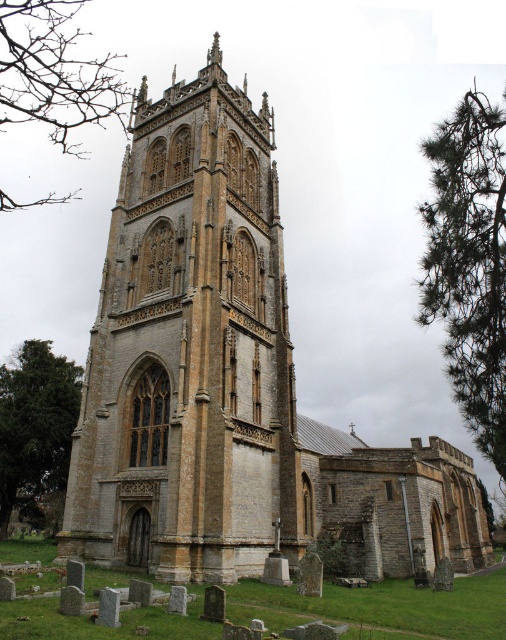
Does green needle-like leaves at right appear over green textured tree at lower left?

Correct, green needle-like leaves at right is located above green textured tree at lower left.

Can you confirm if green needle-like leaves at right is wider than green textured tree at lower left?

Correct, the width of green needle-like leaves at right exceeds that of green textured tree at lower left.

Locate an element on the screen. This screenshot has width=506, height=640. green needle-like leaves at right is located at coordinates (470, 262).

Locate an element on the screen. green needle-like leaves at right is located at coordinates (470, 262).

Who is more forward, (463,323) or (17,90)?

Point (463,323) is more forward.

The width and height of the screenshot is (506, 640). I want to click on green needle-like leaves at right, so click(x=470, y=262).

Locate an element on the screen. green needle-like leaves at right is located at coordinates (470, 262).

Is yellow stone tower at center to the right of green textured tree at lower left from the viewer's perspective?

Indeed, yellow stone tower at center is positioned on the right side of green textured tree at lower left.

Measure the distance between yellow stone tower at center and camera.

They are 47.01 meters apart.

Locate an element on the screen. This screenshot has height=640, width=506. yellow stone tower at center is located at coordinates (190, 353).